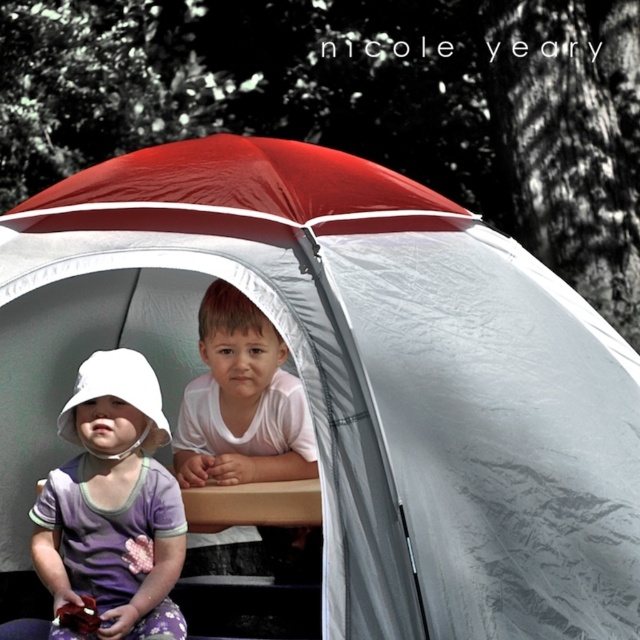
Is purple cotton dress at lower left smaller than white matte shirt at center?

Indeed, purple cotton dress at lower left has a smaller size compared to white matte shirt at center.

Which is more to the left, purple cotton dress at lower left or white matte shirt at center?

purple cotton dress at lower left is more to the left.

Where is `purple cotton dress at lower left`? The height and width of the screenshot is (640, 640). purple cotton dress at lower left is located at coordinates (113, 502).

Where is `purple cotton dress at lower left`? The image size is (640, 640). purple cotton dress at lower left is located at coordinates (113, 502).